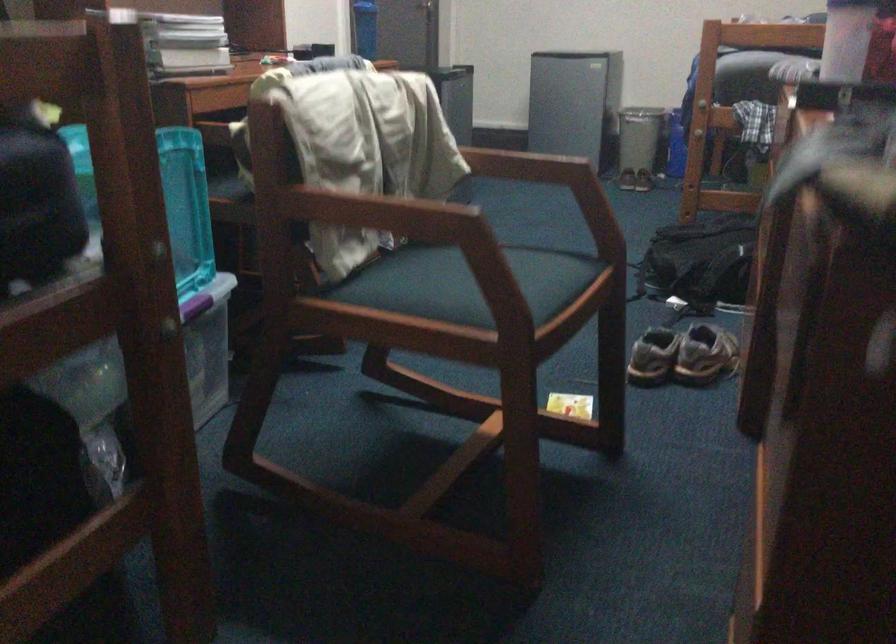
Find the location of a particular element. The image size is (896, 644). chair sitting surface is located at coordinates (543, 242).